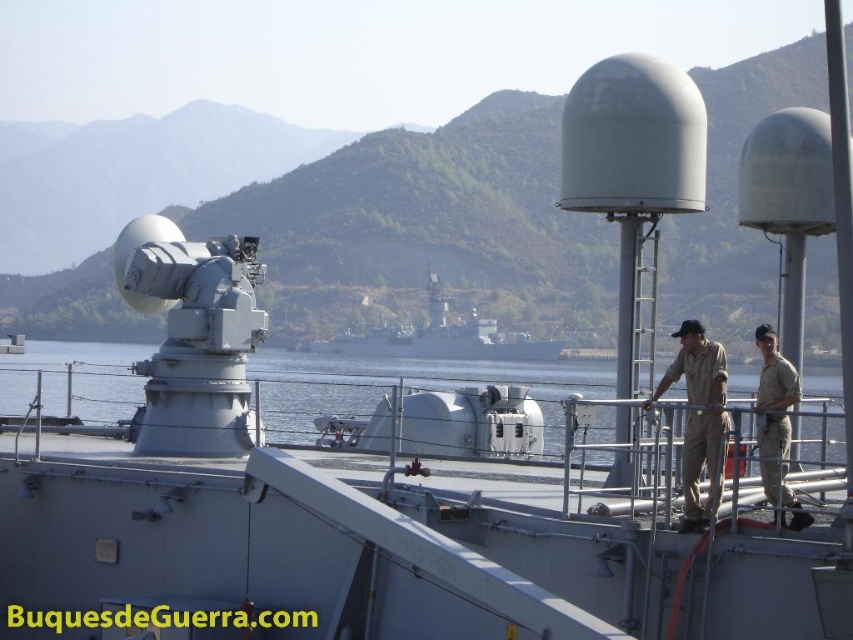
Question: Is clear blue water at center wider than tan uniform at right?

Choices:
 (A) no
 (B) yes

Answer: (B)

Question: Which point is farther to the camera?

Choices:
 (A) tan uniform at right
 (B) khaki uniform at center
 (C) metallic gray ship at center

Answer: (C)

Question: Can you confirm if khaki uniform at center is positioned to the left of tan uniform at right?

Choices:
 (A) no
 (B) yes

Answer: (B)

Question: Does metallic gray ship at center appear over tan uniform at right?

Choices:
 (A) yes
 (B) no

Answer: (B)

Question: Among these points, which one is nearest to the camera?

Choices:
 (A) (515, 333)
 (B) (685, 506)

Answer: (B)

Question: Which point appears closest to the camera in this image?

Choices:
 (A) (764, 413)
 (B) (120, 404)
 (C) (786, 449)

Answer: (A)